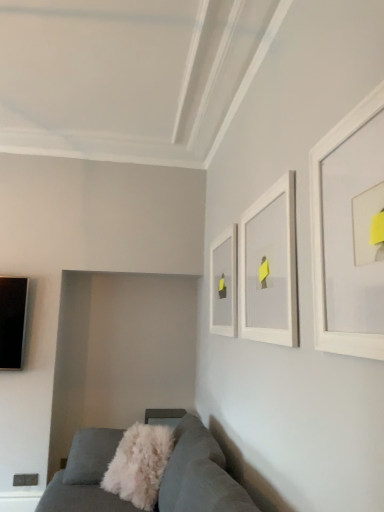
Measure the distance between white matte picture frame at upper center, which is counted as the 3th picture frame, starting from the right, and camera.

white matte picture frame at upper center, which is counted as the 3th picture frame, starting from the right, is 7.97 feet from camera.

Consider the image. In order to face velvet grey couch at lower left, should I rotate leftwards or rightwards?

You should look left and rotate roughly 8.901 degrees.

Image resolution: width=384 pixels, height=512 pixels. What do you see at coordinates (270, 266) in the screenshot? I see `white matte picture frame at upper center, positioned as the second picture frame in left-to-right order` at bounding box center [270, 266].

What do you see at coordinates (139, 464) in the screenshot? I see `white fluffy throw pillow at lower center` at bounding box center [139, 464].

Identify the location of white matte picture frame at upper right, acting as the first picture frame starting from the front. This screenshot has width=384, height=512. (322, 234).

Locate an element on the screen. This screenshot has height=512, width=384. white matte picture frame at upper center, which is the 1th picture frame from back to front is located at coordinates (224, 283).

This screenshot has width=384, height=512. Identify the location of picture frame on the right of the white matte picture frame at upper center, the second picture frame when ordered from right to left. (322, 234).

From the image's perspective, does white matte picture frame at upper center, the second picture frame when ordered from right to left, appear lower than white matte picture frame at upper right, placed as the third picture frame when sorted from back to front?

Correct, white matte picture frame at upper center, the second picture frame when ordered from right to left, appears lower than white matte picture frame at upper right, placed as the third picture frame when sorted from back to front, in the image.

In the scene shown: Considering the relative sizes of white matte picture frame at upper center, positioned as the second picture frame in back-to-front order, and white matte picture frame at upper right, which is the first picture frame from right to left, in the image provided, is white matte picture frame at upper center, positioned as the second picture frame in back-to-front order, shorter than white matte picture frame at upper right, which is the first picture frame from right to left,?

Correct, white matte picture frame at upper center, positioned as the second picture frame in back-to-front order, is not as tall as white matte picture frame at upper right, which is the first picture frame from right to left.

Which object is thinner, white matte picture frame at upper center, positioned as the second picture frame in back-to-front order, or white matte picture frame at upper right, the third picture frame from the left?

white matte picture frame at upper right, the third picture frame from the left.

From the image's perspective, which one is positioned lower, white fluffy throw pillow at lower center or white matte picture frame at upper right, acting as the first picture frame starting from the front?

white fluffy throw pillow at lower center appears lower in the image.

Based on their sizes in the image, would you say white fluffy throw pillow at lower center is bigger or smaller than white matte picture frame at upper right, acting as the first picture frame starting from the front?

In the image, white fluffy throw pillow at lower center appears to be larger than white matte picture frame at upper right, acting as the first picture frame starting from the front.

Does white fluffy throw pillow at lower center turn towards white matte picture frame at upper right, acting as the first picture frame starting from the front?

No, white fluffy throw pillow at lower center is not oriented towards white matte picture frame at upper right, acting as the first picture frame starting from the front.

Could you measure the distance between white fluffy throw pillow at lower center and white matte picture frame at upper right, placed as the third picture frame when sorted from back to front?

Answer: 5.81 feet.

Is velvet grey couch at lower left shorter than white fluffy throw pillow at lower center?

Incorrect, the height of velvet grey couch at lower left does not fall short of that of white fluffy throw pillow at lower center.

Does velvet grey couch at lower left have a greater width compared to white fluffy throw pillow at lower center?

Yes, velvet grey couch at lower left is wider than white fluffy throw pillow at lower center.

Looking at this image, would you say velvet grey couch at lower left is a long distance from white fluffy throw pillow at lower center?

They are positioned close to each other.

In the scene shown: Which of these two, velvet grey couch at lower left or white fluffy throw pillow at lower center, is bigger?

velvet grey couch at lower left is bigger.

Is velvet grey couch at lower left with white matte picture frame at upper right, acting as the first picture frame starting from the front?

They are not placed beside each other.

Which object is positioned more to the left, velvet grey couch at lower left or white matte picture frame at upper right, which is the first picture frame from right to left?

Positioned to the left is velvet grey couch at lower left.

Is white matte picture frame at upper right, acting as the first picture frame starting from the front, at the back of velvet grey couch at lower left?

No, white matte picture frame at upper right, acting as the first picture frame starting from the front, is not at the back of velvet grey couch at lower left.

There is a velvet grey couch at lower left. Where is `the 3rd picture frame above it (from the image's perspective)`? This screenshot has width=384, height=512. the 3rd picture frame above it (from the image's perspective) is located at coordinates (322, 234).

Could you measure the distance between white matte picture frame at upper right, which is the first picture frame from right to left, and white matte picture frame at upper center, the first picture frame positioned from the left?

They are 1.36 meters apart.

Considering the sizes of objects white matte picture frame at upper right, the third picture frame from the left, and white matte picture frame at upper center, the first picture frame positioned from the left, in the image provided, who is taller, white matte picture frame at upper right, the third picture frame from the left, or white matte picture frame at upper center, the first picture frame positioned from the left,?

white matte picture frame at upper right, the third picture frame from the left.

From the white matte picture frame at upper right, acting as the first picture frame starting from the front, count the 2nd picture frame to the left and point to it. Please provide its 2D coordinates.

[(224, 283)]

In the scene shown: Is white matte picture frame at upper center, placed as the third picture frame when sorted from front to back, completely or partially inside white matte picture frame at upper right, placed as the third picture frame when sorted from back to front?

No, white matte picture frame at upper right, placed as the third picture frame when sorted from back to front, does not contain white matte picture frame at upper center, placed as the third picture frame when sorted from front to back.

Does white matte picture frame at upper center, which is counted as the 3th picture frame, starting from the right, turn towards velvet grey couch at lower left?

No, white matte picture frame at upper center, which is counted as the 3th picture frame, starting from the right, is not oriented towards velvet grey couch at lower left.

Can you confirm if white matte picture frame at upper center, the first picture frame positioned from the left, is smaller than velvet grey couch at lower left?

Yes.

How different are the orientations of white matte picture frame at upper center, placed as the third picture frame when sorted from front to back, and velvet grey couch at lower left in degrees?

The angle between the facing direction of white matte picture frame at upper center, placed as the third picture frame when sorted from front to back, and the facing direction of velvet grey couch at lower left is 0.207 degrees.

The width and height of the screenshot is (384, 512). I want to click on throw pillow below the white matte picture frame at upper right, placed as the third picture frame when sorted from back to front (from a real-world perspective), so click(x=139, y=464).

Are white matte picture frame at upper right, which is the first picture frame from right to left, and white fluffy throw pillow at lower center located far from each other?

white matte picture frame at upper right, which is the first picture frame from right to left, is positioned a significant distance from white fluffy throw pillow at lower center.

Based on the photo, considering the sizes of objects white matte picture frame at upper right, acting as the first picture frame starting from the front, and white fluffy throw pillow at lower center in the image provided, who is bigger, white matte picture frame at upper right, acting as the first picture frame starting from the front, or white fluffy throw pillow at lower center?

With larger size is white fluffy throw pillow at lower center.

From a real-world perspective, relative to white fluffy throw pillow at lower center, is white matte picture frame at upper right, which is the first picture frame from right to left, vertically above or below?

In terms of real-world spatial position, white matte picture frame at upper right, which is the first picture frame from right to left, is above white fluffy throw pillow at lower center.

Where is `picture frame in front of the white matte picture frame at upper center, the second picture frame when ordered from right to left`? picture frame in front of the white matte picture frame at upper center, the second picture frame when ordered from right to left is located at coordinates (322, 234).

The height and width of the screenshot is (512, 384). Identify the location of picture frame that is the 3rd object located above the white fluffy throw pillow at lower center (from the image's perspective). (322, 234).

When comparing their distances from white matte picture frame at upper right, acting as the first picture frame starting from the front, does white matte picture frame at upper center, which ranks as the second picture frame in front-to-back order, or white fluffy throw pillow at lower center seem further?

Among the two, white fluffy throw pillow at lower center is located further to white matte picture frame at upper right, acting as the first picture frame starting from the front.

Which object lies nearer to the anchor point white matte picture frame at upper right, acting as the first picture frame starting from the front, white fluffy throw pillow at lower center or white matte picture frame at upper center, the first picture frame positioned from the left?

The object closer to white matte picture frame at upper right, acting as the first picture frame starting from the front, is white matte picture frame at upper center, the first picture frame positioned from the left.

When comparing their distances from velvet grey couch at lower left, does white matte picture frame at upper right, the third picture frame from the left, or white fluffy throw pillow at lower center seem closer?

Among the two, white fluffy throw pillow at lower center is located nearer to velvet grey couch at lower left.

From the image, which object appears to be farther from white fluffy throw pillow at lower center, white matte picture frame at upper center, the first picture frame positioned from the left, or white matte picture frame at upper center, positioned as the second picture frame in left-to-right order?

white matte picture frame at upper center, positioned as the second picture frame in left-to-right order, lies further to white fluffy throw pillow at lower center than the other object.

From the image, which object appears to be nearer to white matte picture frame at upper center, positioned as the second picture frame in back-to-front order, white fluffy throw pillow at lower center or velvet grey couch at lower left?

velvet grey couch at lower left is closer to white matte picture frame at upper center, positioned as the second picture frame in back-to-front order.

Based on their spatial positions, is white fluffy throw pillow at lower center or white matte picture frame at upper right, placed as the third picture frame when sorted from back to front, closer to white matte picture frame at upper center, placed as the third picture frame when sorted from front to back?

white fluffy throw pillow at lower center is positioned closer to the anchor white matte picture frame at upper center, placed as the third picture frame when sorted from front to back.

Considering their positions, is white matte picture frame at upper right, placed as the third picture frame when sorted from back to front, positioned further to white matte picture frame at upper center, which is the 1th picture frame from back to front, than velvet grey couch at lower left?

white matte picture frame at upper right, placed as the third picture frame when sorted from back to front, is further to white matte picture frame at upper center, which is the 1th picture frame from back to front.

From the image, which object appears to be farther from white fluffy throw pillow at lower center, white matte picture frame at upper center, positioned as the second picture frame in back-to-front order, or white matte picture frame at upper right, the third picture frame from the left?

white matte picture frame at upper right, the third picture frame from the left, is further to white fluffy throw pillow at lower center.

Where is `throw pillow between white matte picture frame at upper center, positioned as the second picture frame in left-to-right order, and velvet grey couch at lower left vertically`? throw pillow between white matte picture frame at upper center, positioned as the second picture frame in left-to-right order, and velvet grey couch at lower left vertically is located at coordinates (139, 464).

Find the location of `picture frame between white matte picture frame at upper center, the second picture frame when ordered from right to left, and white fluffy throw pillow at lower center in the up-down direction`. picture frame between white matte picture frame at upper center, the second picture frame when ordered from right to left, and white fluffy throw pillow at lower center in the up-down direction is located at coordinates (224, 283).

The image size is (384, 512). What are the coordinates of `throw pillow located between velvet grey couch at lower left and white matte picture frame at upper center, which is counted as the 3th picture frame, starting from the right, in the depth direction` in the screenshot? It's located at (139, 464).

Identify the location of throw pillow between white matte picture frame at upper right, acting as the first picture frame starting from the front, and white matte picture frame at upper center, which is counted as the 3th picture frame, starting from the right, from front to back. (139, 464).